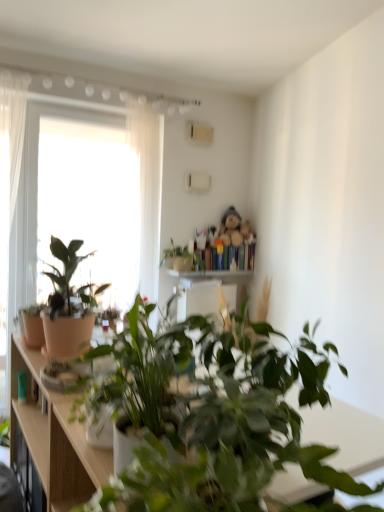
What do you see at coordinates (227, 257) in the screenshot? I see `wooden bookshelf at upper center` at bounding box center [227, 257].

At what (x,y) coordinates should I click in order to perform the action: click on matte terracotta pot at left, arranged as the second houseplant when viewed from the back. Please return your answer as a coordinate pair (x, y). Looking at the image, I should click on (69, 303).

Locate an element on the screen. green matte plant at upper center, marked as the 4th houseplant in a front-to-back arrangement is located at coordinates (180, 257).

At what (x,y) coordinates should I click in order to perform the action: click on wooden at center. Please return your answer as a coordinate pair (x, y). Looking at the image, I should click on (213, 274).

Image resolution: width=384 pixels, height=512 pixels. Describe the element at coordinates (88, 203) in the screenshot. I see `transparent glass window at upper left` at that location.

Locate an element on the screen. The image size is (384, 512). green leafy plant at center, the third houseplant viewed from the back is located at coordinates (210, 415).

Looking at this image, considering the sizes of objects green leafy plant at center, the third houseplant viewed from the back, and wooden bookshelf at upper center in the image provided, who is smaller, green leafy plant at center, the third houseplant viewed from the back, or wooden bookshelf at upper center?

wooden bookshelf at upper center.

Which is nearer, (158,353) or (251,253)?

Positioned in front is point (158,353).

Is green leafy plant at center, which is counted as the second houseplant, starting from the front, shorter than wooden bookshelf at upper center?

No.

From a real-world perspective, between green leafy plant at center, the third houseplant viewed from the back, and wooden bookshelf at upper center, who is vertically higher?

wooden bookshelf at upper center, from a real-world perspective.

Could you measure the distance between wooden bookshelf at upper center and matte white pot at center, which is the fourth houseplant in back-to-front order?

wooden bookshelf at upper center is 8.66 feet away from matte white pot at center, which is the fourth houseplant in back-to-front order.

Looking at this image, considering the sizes of objects wooden bookshelf at upper center and matte white pot at center, the first houseplant in the front-to-back sequence, in the image provided, who is taller, wooden bookshelf at upper center or matte white pot at center, the first houseplant in the front-to-back sequence,?

matte white pot at center, the first houseplant in the front-to-back sequence, is taller.

Is the depth of wooden bookshelf at upper center less than that of matte white pot at center, which is the fourth houseplant in back-to-front order?

No, wooden bookshelf at upper center is behind matte white pot at center, which is the fourth houseplant in back-to-front order.

Does wooden bookshelf at upper center turn towards matte white pot at center, which is the fourth houseplant in back-to-front order?

No, wooden bookshelf at upper center is not aimed at matte white pot at center, which is the fourth houseplant in back-to-front order.

Are wooden at center and matte terracotta pot at left, arranged as the second houseplant when viewed from the back, located far from each other?

wooden at center is far away from matte terracotta pot at left, arranged as the second houseplant when viewed from the back.

Considering the relative positions of wooden at center and matte terracotta pot at left, arranged as the second houseplant when viewed from the back, in the image provided, is wooden at center behind matte terracotta pot at left, arranged as the second houseplant when viewed from the back,?

Yes.

From the image's perspective, which one is positioned higher, wooden at center or matte terracotta pot at left, arranged as the third houseplant when viewed from the front?

matte terracotta pot at left, arranged as the third houseplant when viewed from the front, is shown above in the image.

Can you confirm if wooden at center is thinner than matte terracotta pot at left, arranged as the second houseplant when viewed from the back?

Yes.

Which object is wider, white sheer curtain at upper left or wooden at center?

wooden at center is wider.

Consider the image. Is white sheer curtain at upper left facing away from wooden at center?

white sheer curtain at upper left does not have its back to wooden at center.

Considering the positions of objects white sheer curtain at upper left and wooden at center in the image provided, who is more to the left, white sheer curtain at upper left or wooden at center?

Answer: Positioned to the left is white sheer curtain at upper left.

Is matte terracotta pot at left, arranged as the third houseplant when viewed from the front, oriented away from fluffy beige teddy bear at upper center?

No, matte terracotta pot at left, arranged as the third houseplant when viewed from the front, is not facing away from fluffy beige teddy bear at upper center.

Which object is further away from the camera, matte terracotta pot at left, arranged as the second houseplant when viewed from the back, or fluffy beige teddy bear at upper center?

fluffy beige teddy bear at upper center.

Is matte terracotta pot at left, arranged as the third houseplant when viewed from the front, smaller than fluffy beige teddy bear at upper center?

Actually, matte terracotta pot at left, arranged as the third houseplant when viewed from the front, might be larger than fluffy beige teddy bear at upper center.

Between matte terracotta pot at left, arranged as the second houseplant when viewed from the back, and fluffy beige teddy bear at upper center, which one has larger width?

matte terracotta pot at left, arranged as the second houseplant when viewed from the back, is wider.

From the image's perspective, which is above, green matte plant at upper center, marked as the 4th houseplant in a front-to-back arrangement, or matte terracotta pot at left, arranged as the third houseplant when viewed from the front?

green matte plant at upper center, marked as the 4th houseplant in a front-to-back arrangement, appears higher in the image.

Is green matte plant at upper center, placed as the first houseplant when sorted from back to front, aimed at matte terracotta pot at left, arranged as the second houseplant when viewed from the back?

No, green matte plant at upper center, placed as the first houseplant when sorted from back to front, is not facing towards matte terracotta pot at left, arranged as the second houseplant when viewed from the back.

Is green matte plant at upper center, marked as the 4th houseplant in a front-to-back arrangement, wider than matte terracotta pot at left, arranged as the second houseplant when viewed from the back?

Indeed, green matte plant at upper center, marked as the 4th houseplant in a front-to-back arrangement, has a greater width compared to matte terracotta pot at left, arranged as the second houseplant when viewed from the back.

Choose the correct answer: Is wooden at center inside green leafy plant at center, the third houseplant viewed from the back, or outside it?

wooden at center exists outside the volume of green leafy plant at center, the third houseplant viewed from the back.

Looking at this image, which object is more forward, wooden at center or green leafy plant at center, which is counted as the second houseplant, starting from the front?

green leafy plant at center, which is counted as the second houseplant, starting from the front.

Considering the positions of points (242, 274) and (308, 400), is point (242, 274) closer to camera compared to point (308, 400)?

No, (242, 274) is further to viewer.

This screenshot has height=512, width=384. In order to click on the 1st houseplant directly above the wooden at center (from a real-world perspective) in this screenshot , I will do `click(210, 415)`.

The width and height of the screenshot is (384, 512). What are the coordinates of `shelf above the green leafy plant at center, the third houseplant viewed from the back (from the image's perspective)` in the screenshot? It's located at (227, 257).

At what (x,y) coordinates should I click in order to perform the action: click on houseplant that is the 3rd one when counting leftward from the wooden bookshelf at upper center. Please return your answer as a coordinate pair (x, y). This screenshot has height=512, width=384. Looking at the image, I should click on (140, 383).

Considering their positions, is matte brown cabinet at left positioned closer to green matte plant at upper center, marked as the 4th houseplant in a front-to-back arrangement, than matte terracotta pot at left, arranged as the second houseplant when viewed from the back?

Based on the image, matte terracotta pot at left, arranged as the second houseplant when viewed from the back, appears to be nearer to green matte plant at upper center, marked as the 4th houseplant in a front-to-back arrangement.

Which object lies nearer to the anchor point white sheer curtain at upper left, wooden bookshelf at upper center or matte brown cabinet at left?

wooden bookshelf at upper center is positioned closer to the anchor white sheer curtain at upper left.

From the image, which object appears to be farther from matte white pot at center, which is the fourth houseplant in back-to-front order, green matte plant at upper center, marked as the 4th houseplant in a front-to-back arrangement, or transparent glass window at upper left?

transparent glass window at upper left is positioned further to the anchor matte white pot at center, which is the fourth houseplant in back-to-front order.

Considering their positions, is matte brown cabinet at left positioned closer to green matte plant at upper center, marked as the 4th houseplant in a front-to-back arrangement, than white sheer curtain at upper left?

The object closer to green matte plant at upper center, marked as the 4th houseplant in a front-to-back arrangement, is white sheer curtain at upper left.

When comparing their distances from wooden at center, does white sheer curtain at upper left or fluffy beige teddy bear at upper center seem closer?

fluffy beige teddy bear at upper center lies closer to wooden at center than the other object.

Estimate the real-world distances between objects in this image. Which object is further from matte white pot at center, which is the fourth houseplant in back-to-front order, matte brown cabinet at left or green matte plant at upper center, marked as the 4th houseplant in a front-to-back arrangement?

green matte plant at upper center, marked as the 4th houseplant in a front-to-back arrangement.

Based on their spatial positions, is white sheer curtain at upper left or matte brown cabinet at left closer to matte terracotta pot at left, arranged as the third houseplant when viewed from the front?

matte brown cabinet at left lies closer to matte terracotta pot at left, arranged as the third houseplant when viewed from the front, than the other object.

Considering their positions, is green matte plant at upper center, marked as the 4th houseplant in a front-to-back arrangement, positioned further to wooden bookshelf at upper center than matte terracotta pot at left, arranged as the second houseplant when viewed from the back?

Based on the image, matte terracotta pot at left, arranged as the second houseplant when viewed from the back, appears to be further to wooden bookshelf at upper center.

Find the location of a particular element. This screenshot has width=384, height=512. window sill between transparent glass window at upper left and fluffy beige teddy bear at upper center is located at coordinates (213, 274).

The height and width of the screenshot is (512, 384). Find the location of `curtain between transparent glass window at upper left and wooden bookshelf at upper center in the horizontal direction`. curtain between transparent glass window at upper left and wooden bookshelf at upper center in the horizontal direction is located at coordinates pos(147,192).

Find the location of a particular element. Image resolution: width=384 pixels, height=512 pixels. window sill between white sheer curtain at upper left and wooden bookshelf at upper center in the horizontal direction is located at coordinates (213, 274).

Identify the location of houseplant positioned between matte terracotta pot at left, arranged as the second houseplant when viewed from the back, and wooden at center from near to far. The width and height of the screenshot is (384, 512). (180, 257).